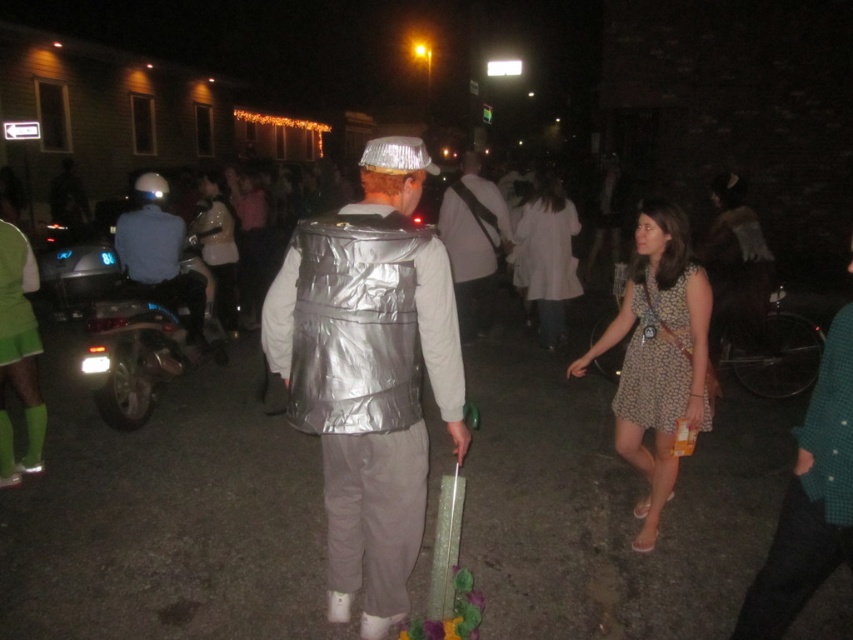
Is white cotton dress at center bigger than matte white dress at center?

Correct, white cotton dress at center is larger in size than matte white dress at center.

Is white cotton dress at center closer to the viewer compared to matte white dress at center?

Yes, it is in front of matte white dress at center.

Between point (556, 211) and point (199, 188), which one is positioned in front?

Point (556, 211) is in front.

This screenshot has height=640, width=853. What are the coordinates of `white cotton dress at center` in the screenshot? It's located at (547, 256).

Can you confirm if dotted fabric dress at lower right is bigger than shiny chrome motorcycle at left?

Indeed, dotted fabric dress at lower right has a larger size compared to shiny chrome motorcycle at left.

Is dotted fabric dress at lower right to the left of shiny chrome motorcycle at left from the viewer's perspective?

In fact, dotted fabric dress at lower right is to the right of shiny chrome motorcycle at left.

Which is behind, point (663, 433) or point (152, 349)?

Point (152, 349)

You are a GUI agent. You are given a task and a screenshot of the screen. Output one action in this format:
    pyautogui.click(x=<x>, y=<y>)
    Task: Click on the dotted fabric dress at lower right
    The image size is (853, 640).
    Given the screenshot: What is the action you would take?
    pyautogui.click(x=659, y=355)

Which is above, shiny chrome motorcycle at left or matte white shirt at center?

Positioned higher is matte white shirt at center.

In the scene shown: Is shiny chrome motorcycle at left above matte white shirt at center?

Incorrect, shiny chrome motorcycle at left is not positioned above matte white shirt at center.

Between point (167, 369) and point (495, 228), which one is positioned behind?

The point (495, 228) is more distant.

This screenshot has width=853, height=640. Find the location of `shiny chrome motorcycle at left`. shiny chrome motorcycle at left is located at coordinates (117, 332).